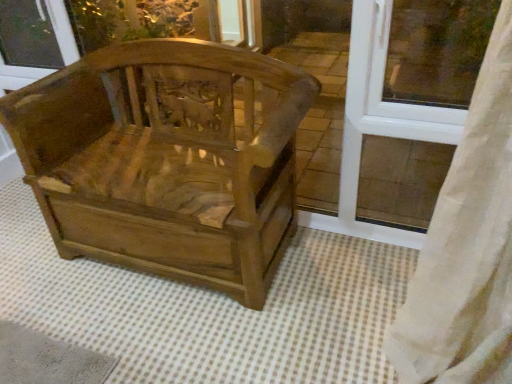
Question: From a real-world perspective, is white plastic window frame at upper right positioned over wooden carved chair at center based on gravity?

Choices:
 (A) yes
 (B) no

Answer: (A)

Question: Is white plastic window frame at upper right behind wooden carved chair at center?

Choices:
 (A) yes
 (B) no

Answer: (A)

Question: Is white plastic window frame at upper right facing towards wooden carved chair at center?

Choices:
 (A) no
 (B) yes

Answer: (A)

Question: From a real-world perspective, does white plastic window frame at upper right sit lower than wooden carved chair at center?

Choices:
 (A) yes
 (B) no

Answer: (B)

Question: Is white plastic window frame at upper right wider than wooden carved chair at center?

Choices:
 (A) yes
 (B) no

Answer: (B)

Question: Does white plastic window frame at upper right have a lesser width compared to wooden carved chair at center?

Choices:
 (A) no
 (B) yes

Answer: (B)

Question: Would you say white plastic window frame at upper right is a long distance from transparent glass window screen at upper left?

Choices:
 (A) no
 (B) yes

Answer: (B)

Question: Is the depth of white plastic window frame at upper right less than that of transparent glass window screen at upper left?

Choices:
 (A) yes
 (B) no

Answer: (A)

Question: Is white plastic window frame at upper right completely or partially outside of transparent glass window screen at upper left?

Choices:
 (A) yes
 (B) no

Answer: (A)

Question: Is white plastic window frame at upper right at the right side of transparent glass window screen at upper left?

Choices:
 (A) no
 (B) yes

Answer: (B)

Question: Does white plastic window frame at upper right appear on the left side of transparent glass window screen at upper left?

Choices:
 (A) no
 (B) yes

Answer: (A)

Question: From a real-world perspective, is white plastic window frame at upper right beneath transparent glass window screen at upper left?

Choices:
 (A) no
 (B) yes

Answer: (A)

Question: Are wooden carved chair at center and transparent glass window screen at upper left located far from each other?

Choices:
 (A) no
 (B) yes

Answer: (A)